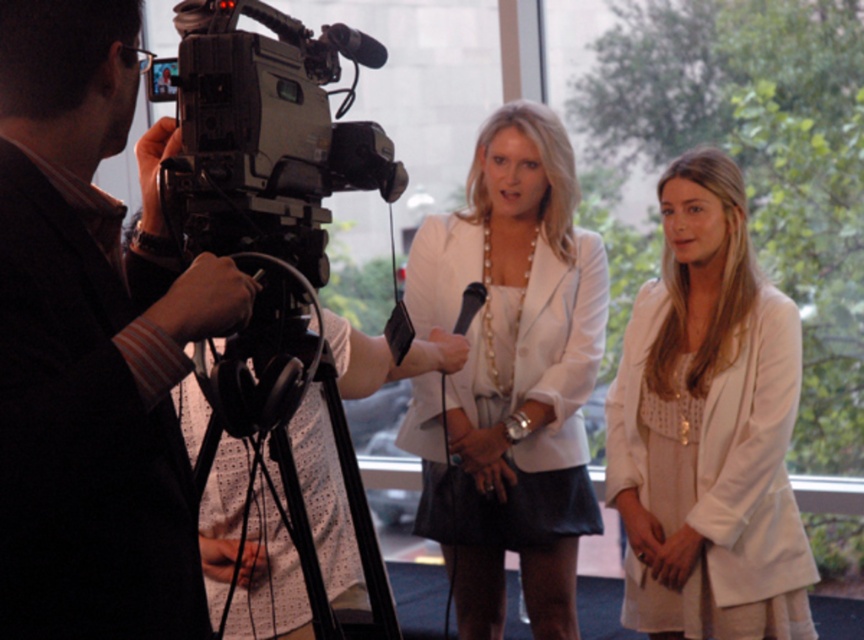
Question: In this image, where is black fabric camera at left located relative to white pearl necklace at center?

Choices:
 (A) right
 (B) left

Answer: (B)

Question: Does white pearl necklace at center appear on the left side of white textured blazer at center?

Choices:
 (A) no
 (B) yes

Answer: (B)

Question: Which object is positioned farthest from the white pearl necklace at center?

Choices:
 (A) white textured blazer at center
 (B) black fabric camera at left

Answer: (B)

Question: Is white pearl necklace at center bigger than white textured blazer at center?

Choices:
 (A) no
 (B) yes

Answer: (B)

Question: Estimate the real-world distances between objects in this image. Which object is closer to the black fabric camera at left?

Choices:
 (A) white textured blazer at center
 (B) white pearl necklace at center

Answer: (B)

Question: Which of the following is the farthest from the observer?

Choices:
 (A) (741, 624)
 (B) (556, 186)
 (C) (124, 476)

Answer: (B)